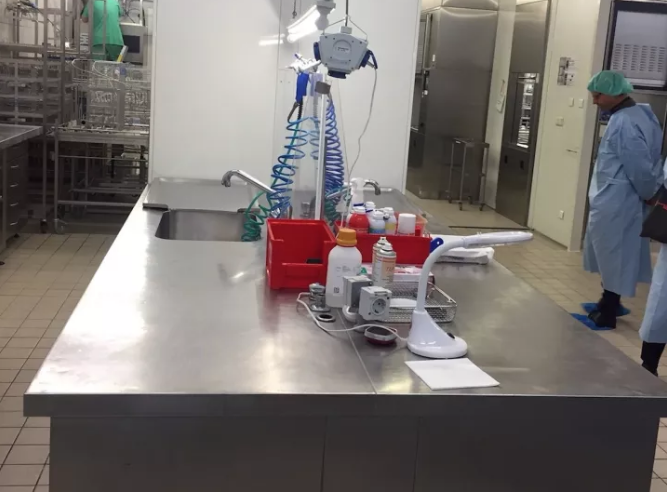
The height and width of the screenshot is (492, 667). I want to click on lamp, so click(428, 334).